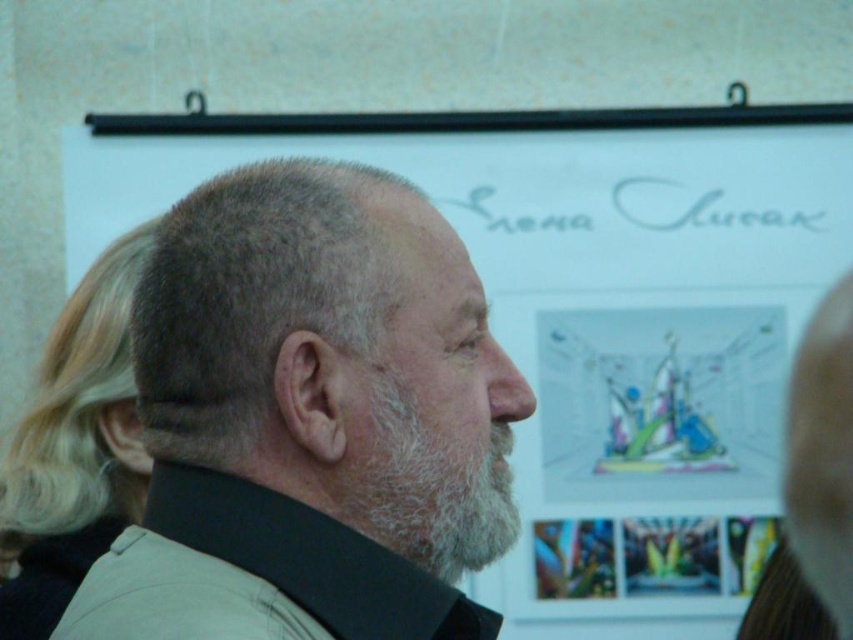
Looking at this image, which of these two, gray hair at center or white fuzzy beard at center, stands taller?

With more height is gray hair at center.

Is gray hair at center in front of white fuzzy beard at center?

Yes, gray hair at center is closer to the viewer.

Does point (456, 600) lie behind point (514, 403)?

No, it is not.

This screenshot has height=640, width=853. Identify the location of gray hair at center. (310, 419).

From the picture: Can you confirm if gray hair at center is taller than gray matte hair at center?

Yes.

Locate an element on the screen. This screenshot has width=853, height=640. gray hair at center is located at coordinates (310, 419).

In order to click on gray hair at center in this screenshot , I will do `click(310, 419)`.

Between gray matte hair at center and white fuzzy beard at center, which one is positioned lower?

white fuzzy beard at center is below.

Is point (323, 237) more distant than point (479, 484)?

No, it is in front of (479, 484).

Is point (270, 321) positioned behind point (453, 497)?

No, (270, 321) is in front of (453, 497).

Find the location of a particular element. This screenshot has width=853, height=640. gray matte hair at center is located at coordinates (259, 300).